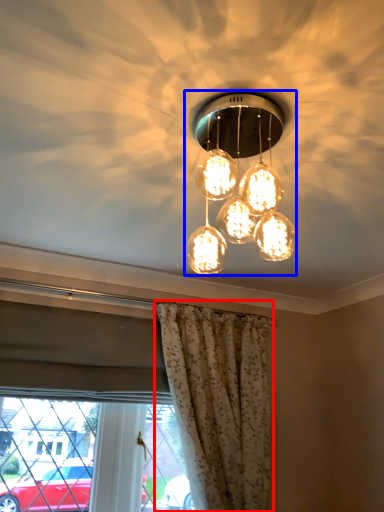
Question: Among these objects, which one is farthest to the camera, curtain (highlighted by a red box) or lamp (highlighted by a blue box)?

Choices:
 (A) curtain
 (B) lamp

Answer: (A)